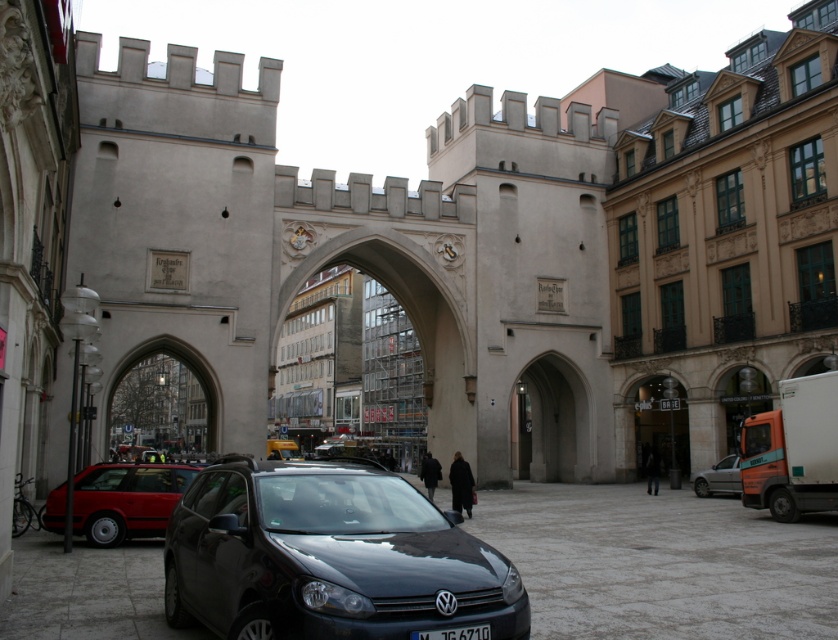
Question: Can you confirm if silver metallic sedan at lower right is positioned to the right of black plastic license plate at center?

Choices:
 (A) yes
 (B) no

Answer: (A)

Question: Does shiny black car at center appear under shiny red sedan at lower left?

Choices:
 (A) no
 (B) yes

Answer: (B)

Question: Which object appears closest to the camera in this image?

Choices:
 (A) shiny black car at center
 (B) shiny red sedan at lower left
 (C) silver metallic sedan at lower right

Answer: (A)

Question: Based on their relative distances, which object is nearer to the silver metallic sedan at lower right?

Choices:
 (A) shiny red sedan at lower left
 (B) black plastic license plate at center

Answer: (B)

Question: Which of the following is the farthest from the observer?

Choices:
 (A) (422, 632)
 (B) (297, 600)
 (C) (117, 474)
 (D) (702, 480)

Answer: (D)

Question: Does silver metallic sedan at lower right appear over black plastic license plate at center?

Choices:
 (A) yes
 (B) no

Answer: (B)